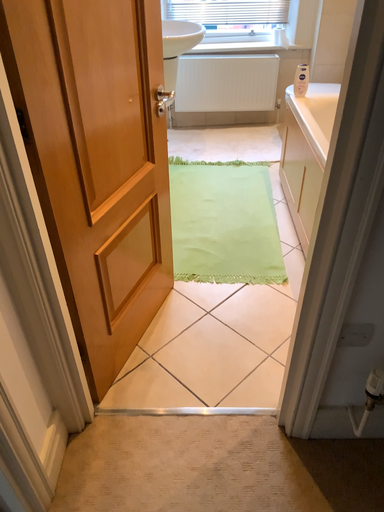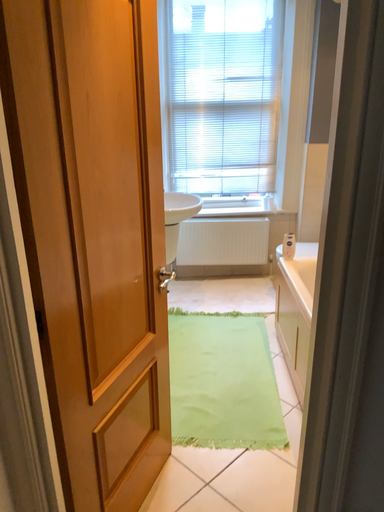
Question: Which way did the camera rotate in the video?

Choices:
 (A) rotated upward
 (B) rotated downward

Answer: (A)